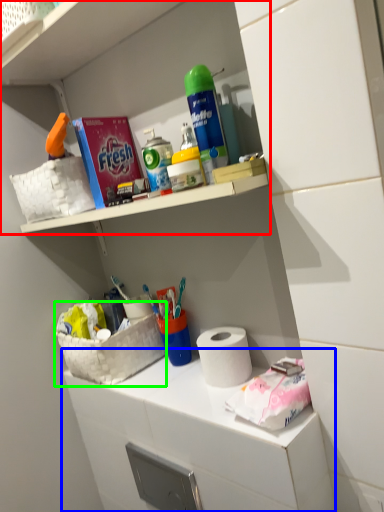
Question: Based on their relative distances, which object is nearer to shelf (highlighted by a red box)? Choose from counter (highlighted by a blue box) and basket (highlighted by a green box).

Choices:
 (A) counter
 (B) basket

Answer: (B)